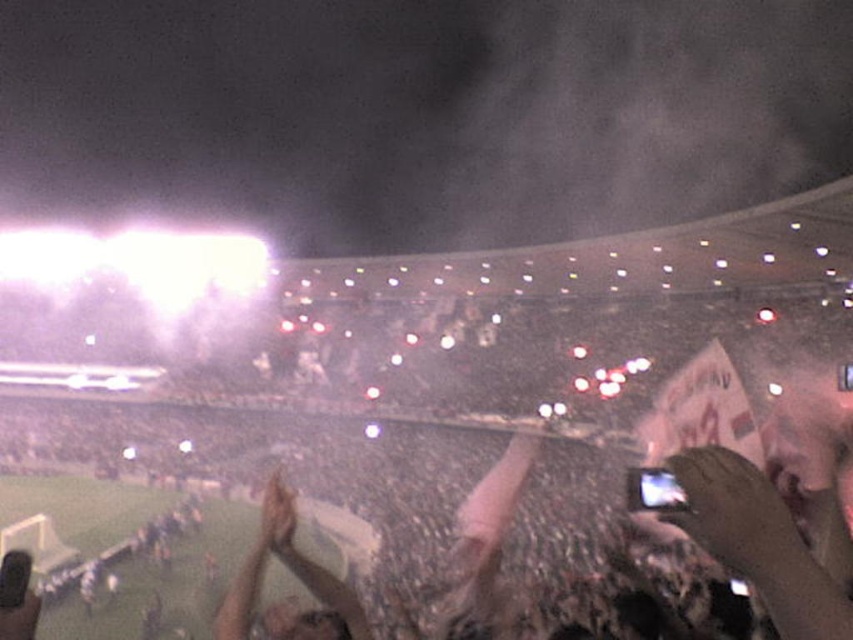
Question: Among these objects, which one is nearest to the camera?

Choices:
 (A) smooth skin hand at center
 (B) smooth brown leather hand at center
 (C) light brown leather jacket at center

Answer: (B)

Question: Which of the following is the farthest from the observer?

Choices:
 (A) (740, 481)
 (B) (277, 497)

Answer: (B)

Question: Where is smooth brown leather hand at center located in relation to light brown leather jacket at center in the image?

Choices:
 (A) left
 (B) right

Answer: (B)

Question: Which of the following is the closest to the observer?

Choices:
 (A) (790, 556)
 (B) (334, 621)
 (C) (287, 502)

Answer: (A)

Question: Does light brown leather jacket at center have a smaller size compared to smooth skin hand at center?

Choices:
 (A) yes
 (B) no

Answer: (B)

Question: Is light brown leather jacket at center positioned behind smooth skin hand at center?

Choices:
 (A) yes
 (B) no

Answer: (B)